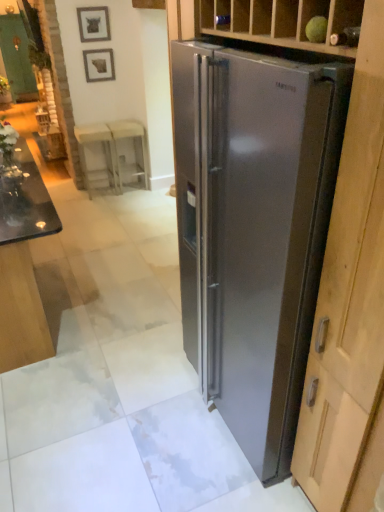
Question: Should I look upward or downward to see metallic silver picture frame at upper center, which is the 1th picture frame from top to bottom?

Choices:
 (A) down
 (B) up

Answer: (B)

Question: Does white plastic stool at center, marked as the second stool in a right-to-left arrangement, have a lesser width compared to black glass table at lower left?

Choices:
 (A) no
 (B) yes

Answer: (B)

Question: Can black glass table at lower left be found inside white plastic stool at center, the 1th stool when ordered from left to right?

Choices:
 (A) yes
 (B) no

Answer: (B)

Question: Considering the relative sizes of white plastic stool at center, marked as the second stool in a right-to-left arrangement, and black glass table at lower left in the image provided, is white plastic stool at center, marked as the second stool in a right-to-left arrangement, shorter than black glass table at lower left?

Choices:
 (A) yes
 (B) no

Answer: (A)

Question: Considering the relative positions of white plastic stool at center, the 1th stool when ordered from left to right, and black glass table at lower left in the image provided, is white plastic stool at center, the 1th stool when ordered from left to right, to the left of black glass table at lower left from the viewer's perspective?

Choices:
 (A) no
 (B) yes

Answer: (A)

Question: Is white plastic stool at center, marked as the second stool in a right-to-left arrangement, facing away from black glass table at lower left?

Choices:
 (A) yes
 (B) no

Answer: (B)

Question: Is white plastic stool at center, marked as the second stool in a right-to-left arrangement, next to black glass table at lower left and touching it?

Choices:
 (A) yes
 (B) no

Answer: (B)

Question: Is metallic silver picture frame at upper center, the second picture frame positioned from the bottom, at the left side of matte gray picture frame at upper left, which appears as the first picture frame when ordered from the bottom?

Choices:
 (A) yes
 (B) no

Answer: (A)

Question: Would you consider metallic silver picture frame at upper center, the second picture frame positioned from the bottom, to be distant from matte gray picture frame at upper left, which is counted as the 2th picture frame, starting from the top?

Choices:
 (A) yes
 (B) no

Answer: (B)

Question: Is metallic silver picture frame at upper center, which is the 1th picture frame from top to bottom, completely or partially outside of matte gray picture frame at upper left, which is counted as the 2th picture frame, starting from the top?

Choices:
 (A) yes
 (B) no

Answer: (A)

Question: Can you confirm if metallic silver picture frame at upper center, the second picture frame positioned from the bottom, is taller than matte gray picture frame at upper left, which is counted as the 2th picture frame, starting from the top?

Choices:
 (A) no
 (B) yes

Answer: (B)

Question: Considering the relative sizes of metallic silver picture frame at upper center, the second picture frame positioned from the bottom, and matte gray picture frame at upper left, which appears as the first picture frame when ordered from the bottom, in the image provided, is metallic silver picture frame at upper center, the second picture frame positioned from the bottom, wider than matte gray picture frame at upper left, which appears as the first picture frame when ordered from the bottom,?

Choices:
 (A) no
 (B) yes

Answer: (A)

Question: Is metallic silver picture frame at upper center, the second picture frame positioned from the bottom, to the right of matte gray picture frame at upper left, which is counted as the 2th picture frame, starting from the top, from the viewer's perspective?

Choices:
 (A) yes
 (B) no

Answer: (B)

Question: Are metallic silver picture frame at upper center, the second picture frame positioned from the bottom, and stainless steel refrigerator at right located far from each other?

Choices:
 (A) no
 (B) yes

Answer: (B)